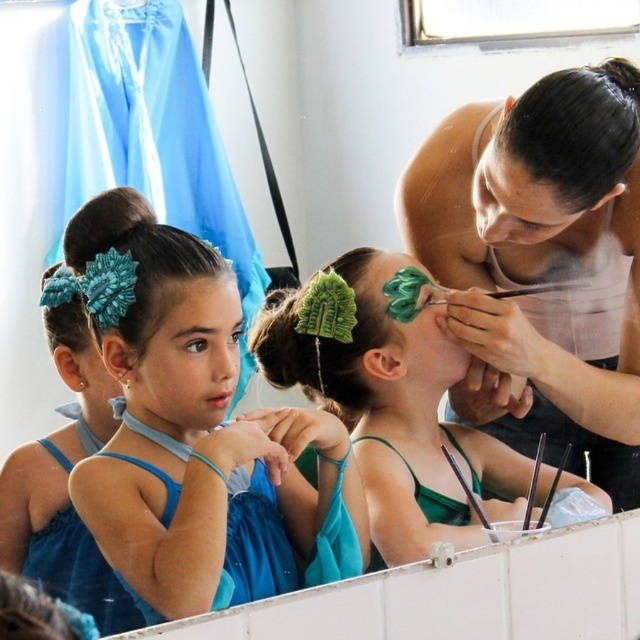
Question: Does matte blue fabric at center appear on the right side of teal fabric flower at center?

Choices:
 (A) no
 (B) yes

Answer: (A)

Question: Can you confirm if matte blue fabric at center is bigger than green fabric flower at center?

Choices:
 (A) no
 (B) yes

Answer: (B)

Question: Estimate the real-world distances between objects in this image. Which object is closer to the matte blue dress at center?

Choices:
 (A) green fabric flower at center
 (B) matte green paintbrush at upper right
 (C) matte blue fabric at center

Answer: (C)

Question: Which point is closer to the camera taking this photo?

Choices:
 (A) (602, 179)
 (B) (136, 352)
 (C) (346, 392)

Answer: (B)

Question: Which of the following is the farthest from the observer?

Choices:
 (A) (116, 250)
 (B) (278, 326)

Answer: (B)

Question: Does matte blue fabric at center appear on the left side of teal fabric flower at center?

Choices:
 (A) no
 (B) yes

Answer: (B)